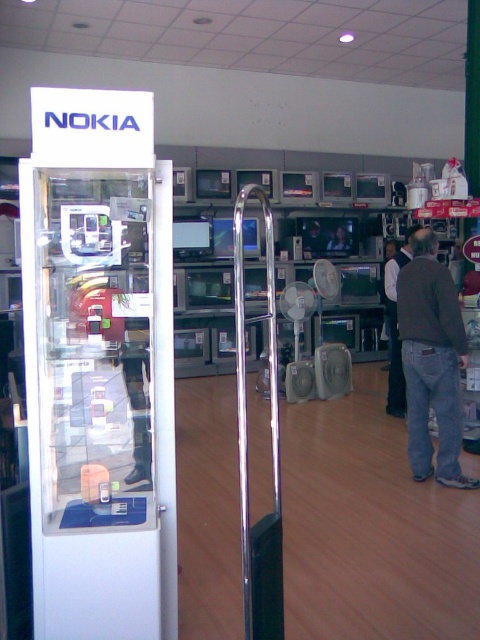
Question: Can you confirm if brown denim jacket at lower right is bigger than smooth plastic tv at center?

Choices:
 (A) yes
 (B) no

Answer: (A)

Question: Is brown denim jacket at lower right to the left of smooth plastic tv at center from the viewer's perspective?

Choices:
 (A) yes
 (B) no

Answer: (B)

Question: Is brown denim jacket at lower right wider than smooth plastic tv at center?

Choices:
 (A) yes
 (B) no

Answer: (A)

Question: Which of the following is the farthest from the observer?

Choices:
 (A) (333, 244)
 (B) (415, 272)

Answer: (A)

Question: Which object appears farthest from the camera in this image?

Choices:
 (A) smooth plastic tv at center
 (B) brown denim jacket at lower right

Answer: (A)